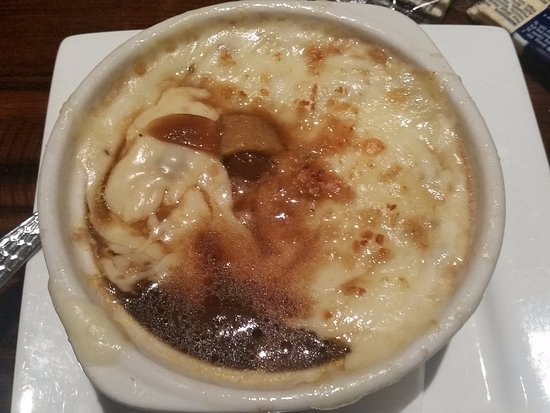
Locate an element on the screen. The height and width of the screenshot is (413, 550). wooden table is located at coordinates (22, 86).